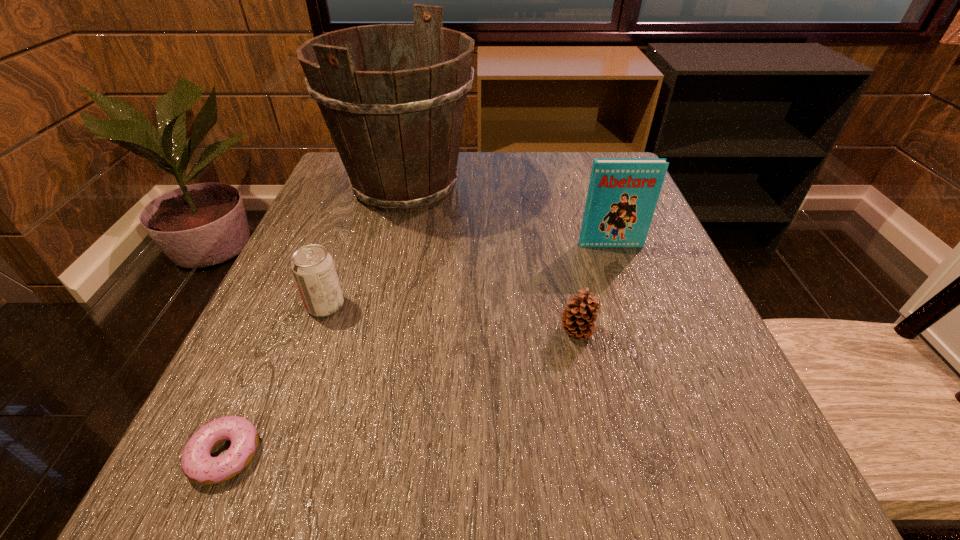
This screenshot has height=540, width=960. Identify the location of object that is positioned at the far left corner. (398, 132).

Identify the location of object present at the near left corner. (198, 465).

In the image, there is a desktop. Where is `vacant space at the far edge`? This screenshot has width=960, height=540. vacant space at the far edge is located at coordinates (495, 172).

This screenshot has height=540, width=960. In the image, there is a desktop. In order to click on blank space at the near edge in this screenshot , I will do `click(573, 496)`.

In the image, there is a desktop. Where is `vacant space at the left edge`? Image resolution: width=960 pixels, height=540 pixels. vacant space at the left edge is located at coordinates (348, 301).

The width and height of the screenshot is (960, 540). Identify the location of vacant position at the right edge of the desktop. (763, 442).

Find the location of `vacant space at the near left corner of the desktop`. vacant space at the near left corner of the desktop is located at coordinates (299, 451).

What are the coordinates of `free space at the near right corner of the desktop` in the screenshot? It's located at (737, 503).

The height and width of the screenshot is (540, 960). What are the coordinates of `unoccupied area between the bucket and the soda can` in the screenshot? It's located at (366, 246).

Locate an element on the screen. free space between the pinecone and the third tallest object is located at coordinates (451, 319).